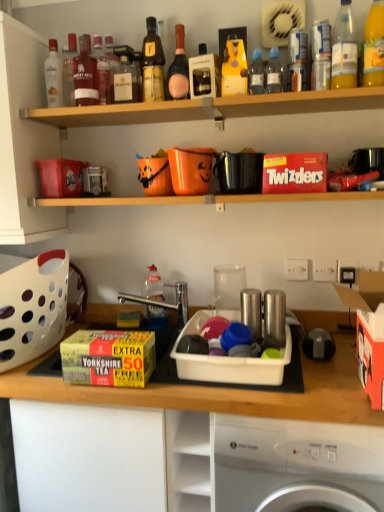
At what (x,y) coordinates should I click in order to perform the action: click on vacant area on the back side of matte glass bottle at upper left, placed as the 12th bottle when sorted from right to left. Please return your answer as a coordinate pair (x, y). Looking at the image, I should click on (77, 117).